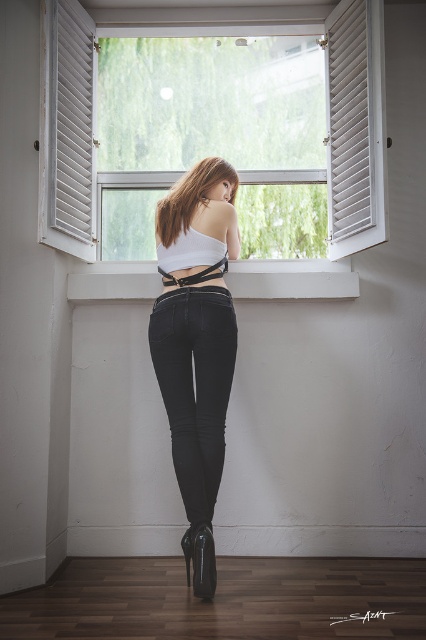
You are standing in the room and want to look outside through the white wooden window at center while also checking your matte black jeans at center. Which direction should you turn your head to see both the window and your jeans without moving your body?

You should turn your head to the left because the white wooden window at center is to the right of the matte black jeans at center, so looking left would allow you to see both.

You are standing in the room and want to look outside through the white wooden window at center. Which direction should you turn your head if you are currently facing the black patent leather boot at lower center?

You should turn your head to the right because the white wooden window at center is to the right of the black patent leather boot at lower center.

You are a delivery person trying to deliver a package to the apartment. The package is too big to fit through the white wooden window at center. Can you fit it through the black patent leather boot at lower center?

The white wooden window at center has a larger size compared to the black patent leather boot at lower center, so the package cannot fit through the black patent leather boot at lower center as it is smaller than the window.